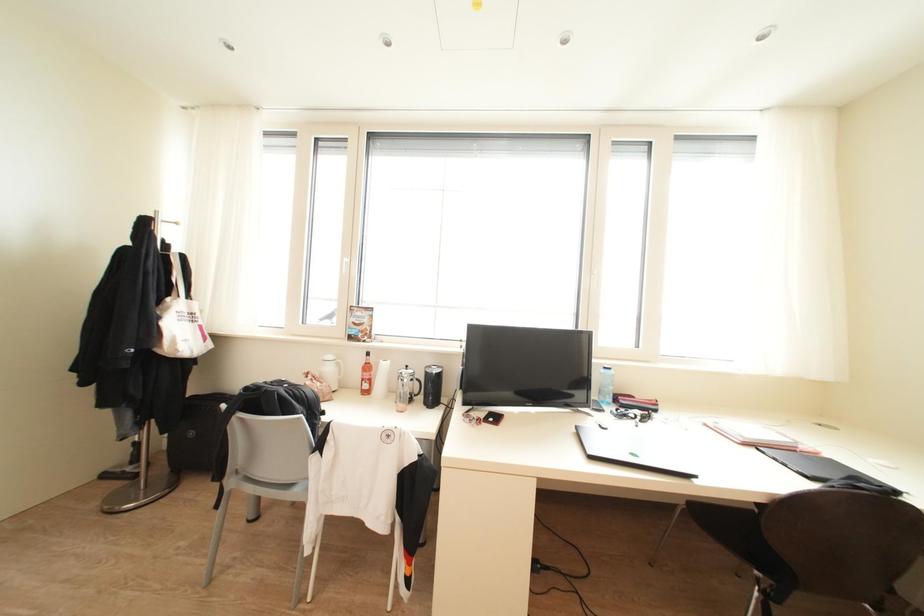
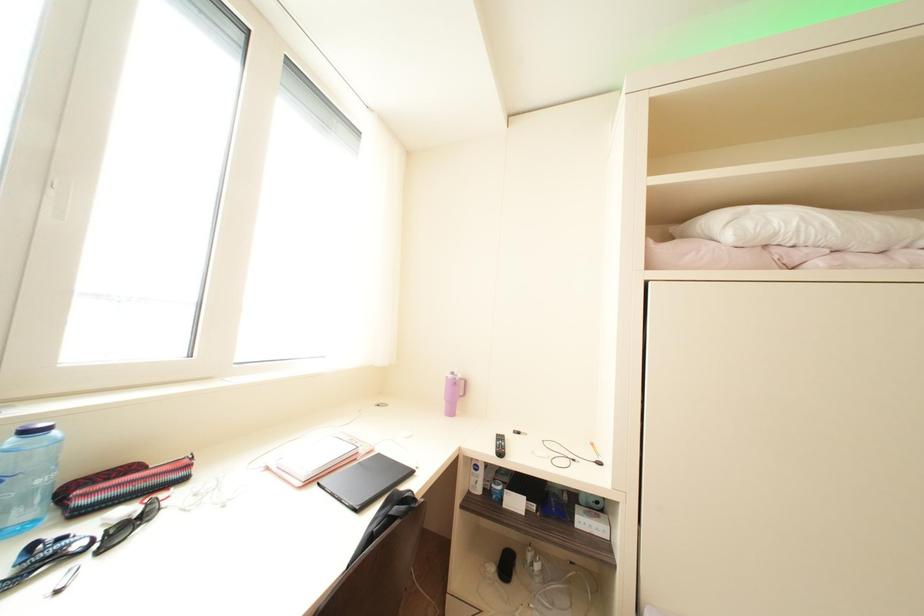
Question: The images are taken continuously from a first-person perspective. In which direction is your viewpoint rotating?

Choices:
 (A) Left
 (B) Right
 (C) Up
 (D) Down

Answer: (B)